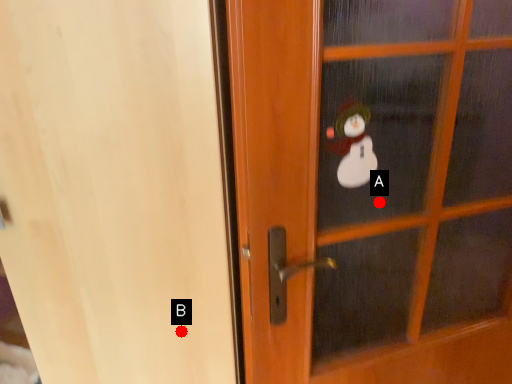
Question: Two points are circled on the image, labeled by A and B beside each circle. Which point appears closest to the camera in this image?

Choices:
 (A) A is closer
 (B) B is closer

Answer: (A)